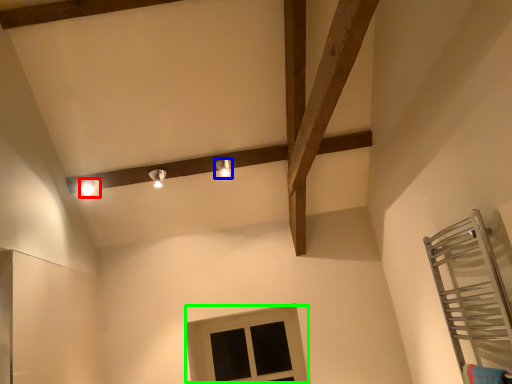
Question: Based on their relative distances, which object is nearer to light fixture (highlighted by a red box)? Choose from light fixture (highlighted by a blue box) and window (highlighted by a green box).

Choices:
 (A) light fixture
 (B) window

Answer: (A)